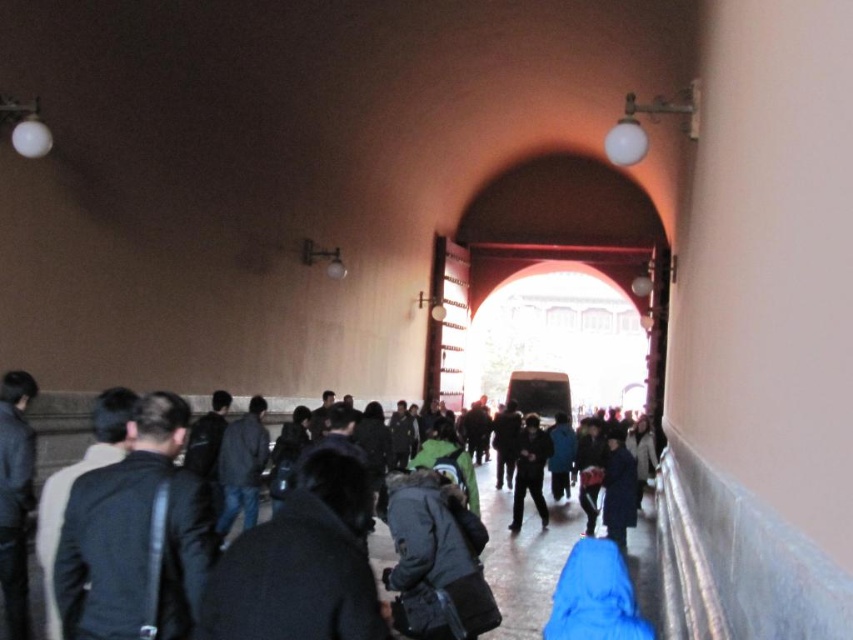
Between point (86, 540) and point (543, 508), which one is positioned in front?

Point (86, 540) is in front.

Does black fabric jacket at left have a lesser width compared to dark gray jacket at center?

Incorrect, black fabric jacket at left's width is not less than dark gray jacket at center's.

Who is more forward, (108, 620) or (532, 416)?

Positioned in front is point (108, 620).

Where is `black fabric jacket at left`? black fabric jacket at left is located at coordinates (135, 534).

Does dark gray coat at center have a greater width compared to dark gray jacket at center?

Yes, dark gray coat at center is wider than dark gray jacket at center.

Is point (380, 545) closer to camera compared to point (520, 468)?

Yes, it is in front of point (520, 468).

At what (x,y) coordinates should I click in order to perform the action: click on dark gray coat at center. Please return your answer as a coordinate pair (x, y). Looking at the image, I should click on (523, 557).

Can you confirm if black fabric jacket at left is taller than dark gray coat at center?

No, black fabric jacket at left is not taller than dark gray coat at center.

Between black fabric jacket at left and dark gray coat at center, which one is positioned lower?

dark gray coat at center

Describe the element at coordinates (135, 534) in the screenshot. This screenshot has width=853, height=640. I see `black fabric jacket at left` at that location.

Locate an element on the screen. This screenshot has height=640, width=853. black fabric jacket at left is located at coordinates (135, 534).